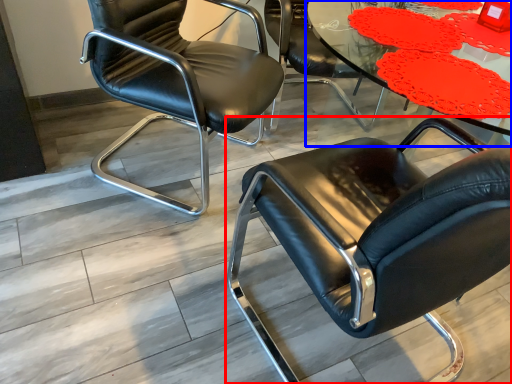
Question: Which object appears closest to the camera in this image, chair (highlighted by a red box) or table (highlighted by a blue box)?

Choices:
 (A) chair
 (B) table

Answer: (A)